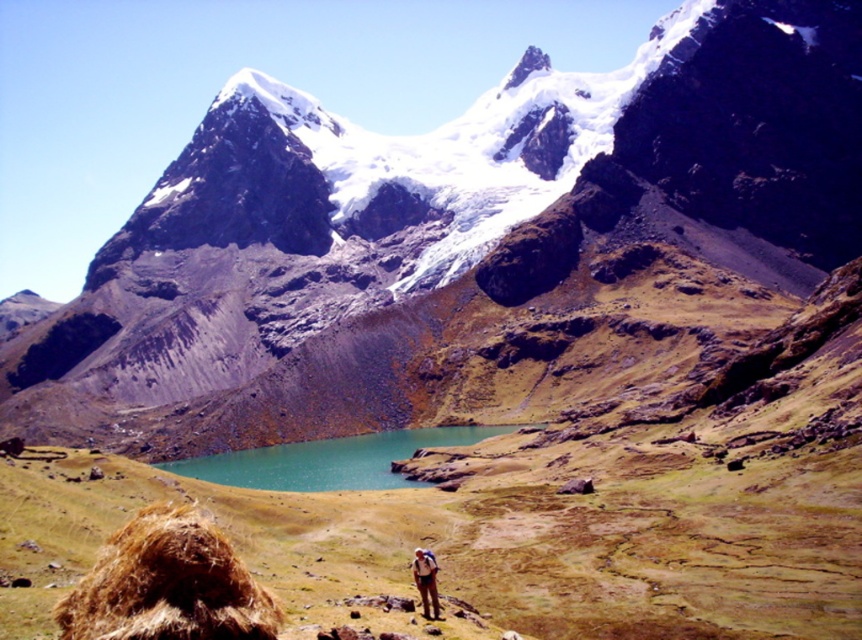
Is brown fluffy hay at lower left further to camera compared to brown fabric pants at lower center?

No, brown fluffy hay at lower left is closer to the viewer.

In the scene shown: Which is above, brown fluffy hay at lower left or brown fabric pants at lower center?

Positioned higher is brown fluffy hay at lower left.

This screenshot has height=640, width=862. In order to click on brown fluffy hay at lower left in this screenshot , I will do `click(167, 584)`.

Who is positioned more to the right, brown fluffy hay at lower left or teal glassy water at center?

teal glassy water at center is more to the right.

Can you confirm if brown fluffy hay at lower left is positioned above teal glassy water at center?

Yes.

Between point (152, 596) and point (515, 426), which one is positioned behind?

Point (515, 426)

This screenshot has width=862, height=640. I want to click on brown fluffy hay at lower left, so click(167, 584).

Between point (586, 326) and point (336, 486), which one is positioned behind?

Point (586, 326)

Between point (336, 324) and point (314, 488), which one is positioned in front?

Point (314, 488) is in front.

Is point (695, 212) positioned behind point (454, 432)?

Yes, point (695, 212) is behind point (454, 432).

You are a GUI agent. You are given a task and a screenshot of the screen. Output one action in this format:
    pyautogui.click(x=<x>, y=<y>)
    Task: Click on the rocky mountain range at center
    This screenshot has height=640, width=862.
    Given the screenshot: What is the action you would take?
    pyautogui.click(x=472, y=248)